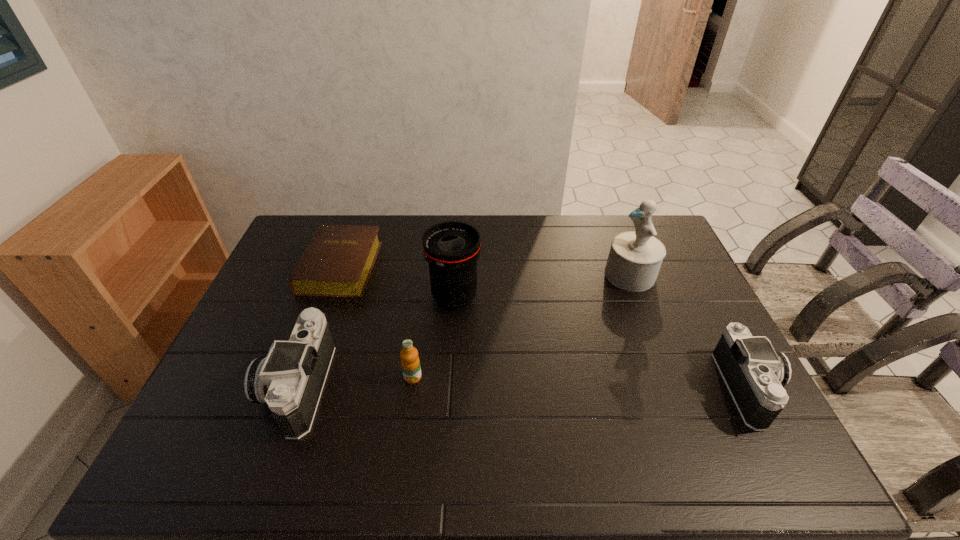
Point out which object is positioned as the fifth nearest to the figurine. Please provide its 2D coordinates. Your answer should be formatted as a tuple, i.e. [(x, y)], where the tuple contains the x and y coordinates of a point satisfying the conditions above.

[(291, 378)]

Locate which object is the fifth closest to the right camera. Please provide its 2D coordinates. Your answer should be formatted as a tuple, i.e. [(x, y)], where the tuple contains the x and y coordinates of a point satisfying the conditions above.

[(291, 378)]

Identify the location of vacant region that satisfies the following two spatial constraints: 1. on the front side of the rightmost object; 2. on the right side of the fifth shortest object. (449, 388).

Find the location of a particular element. This screenshot has height=540, width=960. vacant point that satisfies the following two spatial constraints: 1. on the front side of the taller camera; 2. on the right side of the shorter camera is located at coordinates (298, 388).